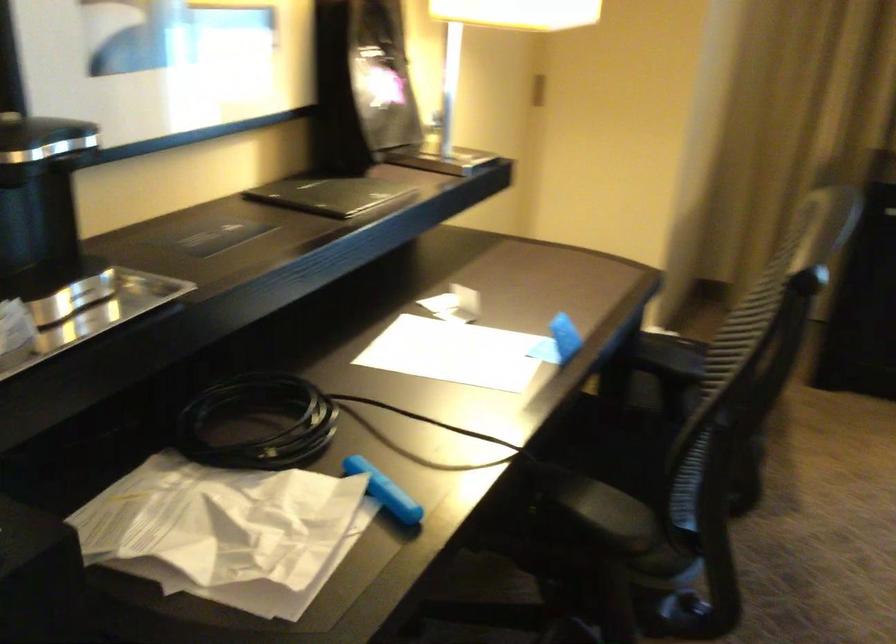
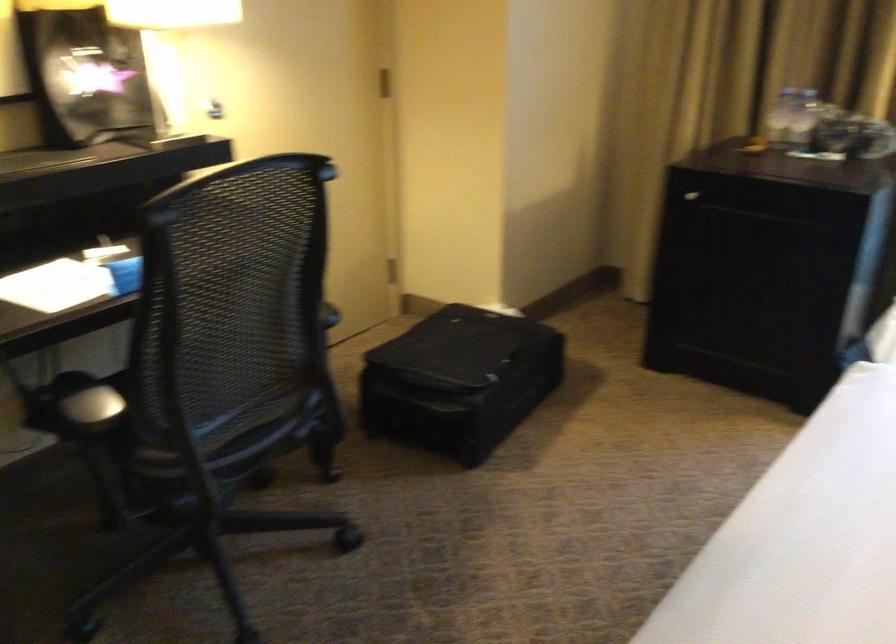
Question: The images are taken continuously from a first-person perspective. In which direction are you moving?

Choices:
 (A) Left
 (B) Right
 (C) Forward
 (D) Backward

Answer: (B)